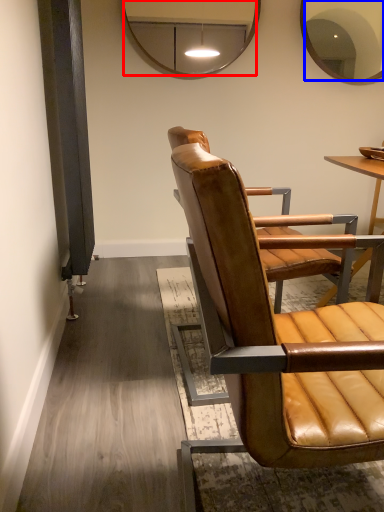
Question: Which object appears closest to the camera in this image, mirror (highlighted by a red box) or mirror (highlighted by a blue box)?

Choices:
 (A) mirror
 (B) mirror

Answer: (A)